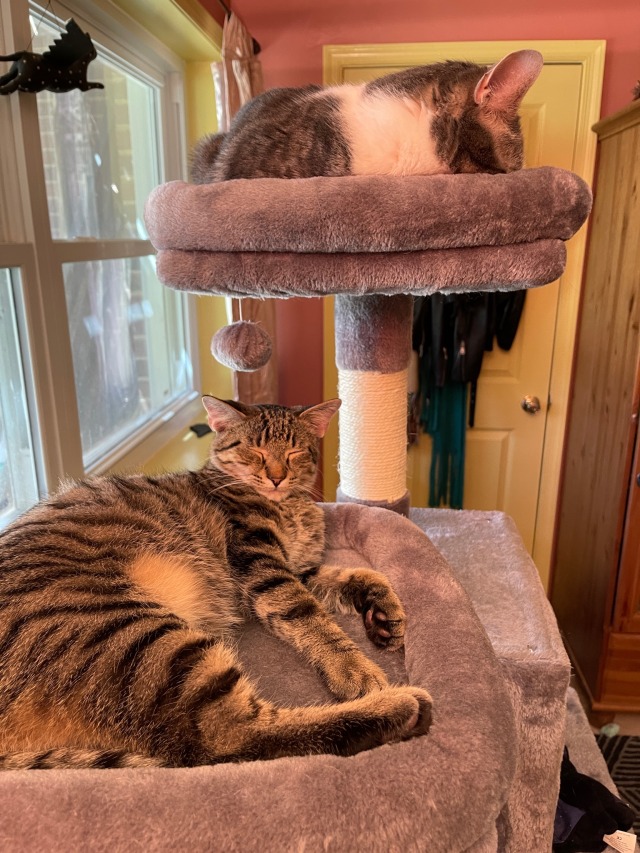
At what (x,y) coordinates should I click in order to perform the action: click on cat sleeping on cat tower. Please return your answer as a coordinate pair (x, y). Looking at the image, I should click on (132, 559), (329, 125).